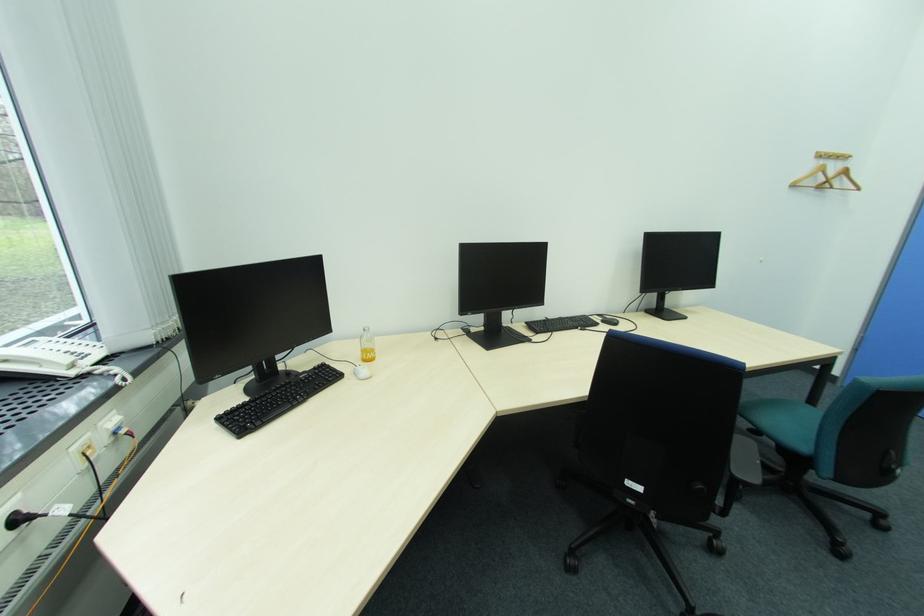
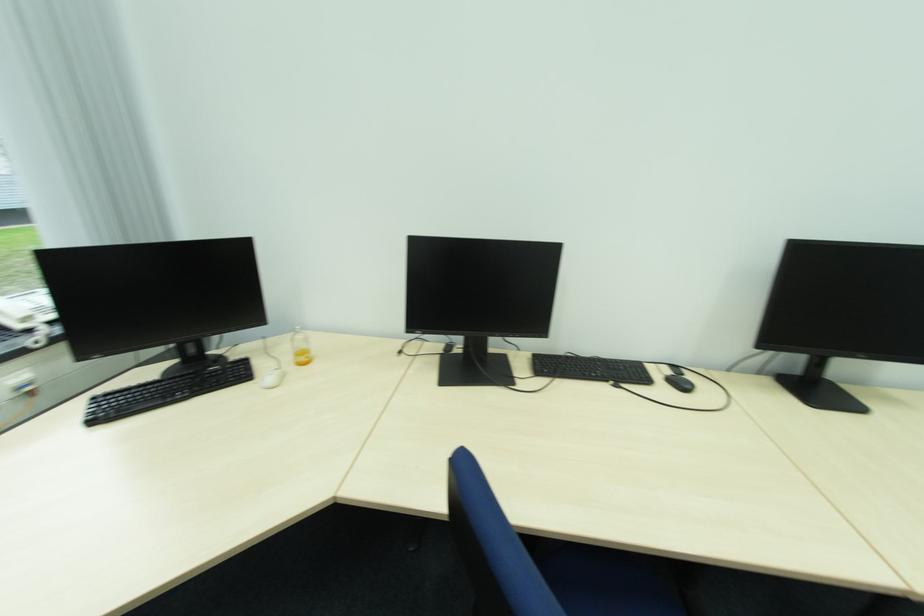
Where in the second image is the point corresponding to pixel 610 322 from the first image?

(677, 379)